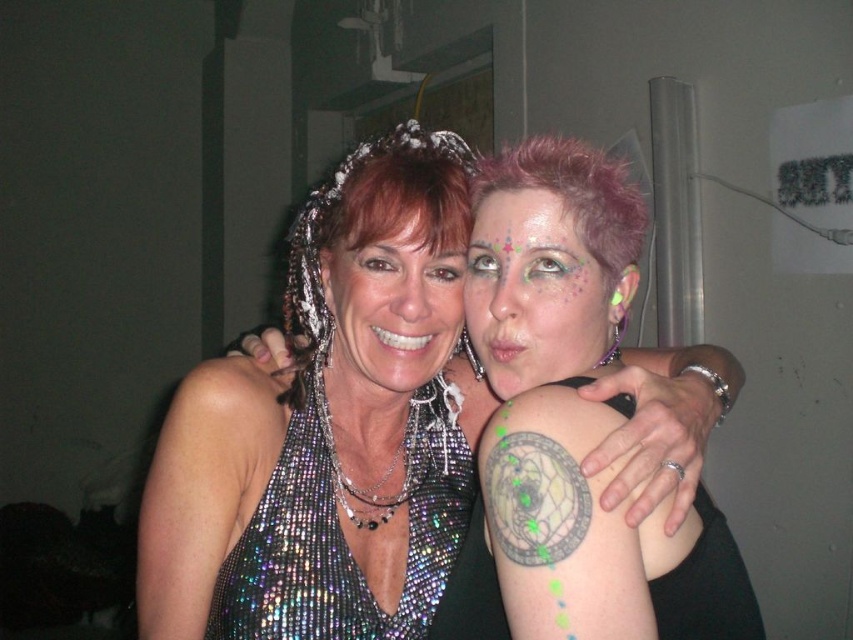
Is holographic sequin dress at center below glittery face paint at center?

Indeed, holographic sequin dress at center is positioned under glittery face paint at center.

Which is more to the left, holographic sequin dress at center or glittery face paint at center?

holographic sequin dress at center is more to the left.

The width and height of the screenshot is (853, 640). I want to click on holographic sequin dress at center, so click(x=344, y=540).

You are a GUI agent. You are given a task and a screenshot of the screen. Output one action in this format:
    pyautogui.click(x=<x>, y=<y>)
    Task: Click on the holographic sequin dress at center
    The height and width of the screenshot is (640, 853).
    Given the screenshot: What is the action you would take?
    pyautogui.click(x=344, y=540)

Is shiny sequined dress at center thinner than pink spiky hair at center?

Yes.

Does shiny sequined dress at center appear on the right side of pink spiky hair at center?

No, shiny sequined dress at center is not to the right of pink spiky hair at center.

Identify the location of shiny sequined dress at center. The height and width of the screenshot is (640, 853). (393, 305).

Find the location of a particular element. The width and height of the screenshot is (853, 640). sparkly silver dress at center is located at coordinates (572, 417).

Is point (508, 442) positioned after point (386, 298)?

No, it is not.

Locate an element on the screen. The height and width of the screenshot is (640, 853). sparkly silver dress at center is located at coordinates (x=572, y=417).